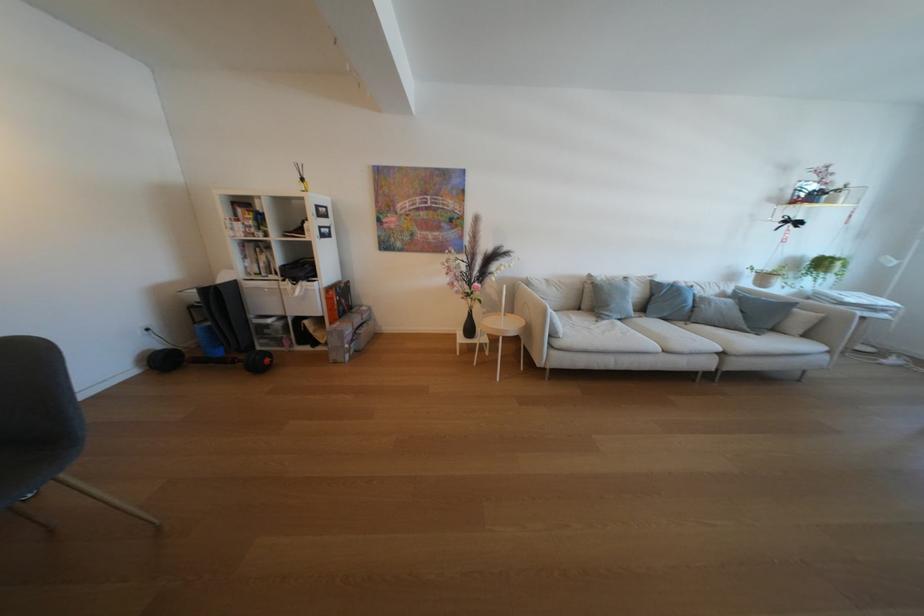
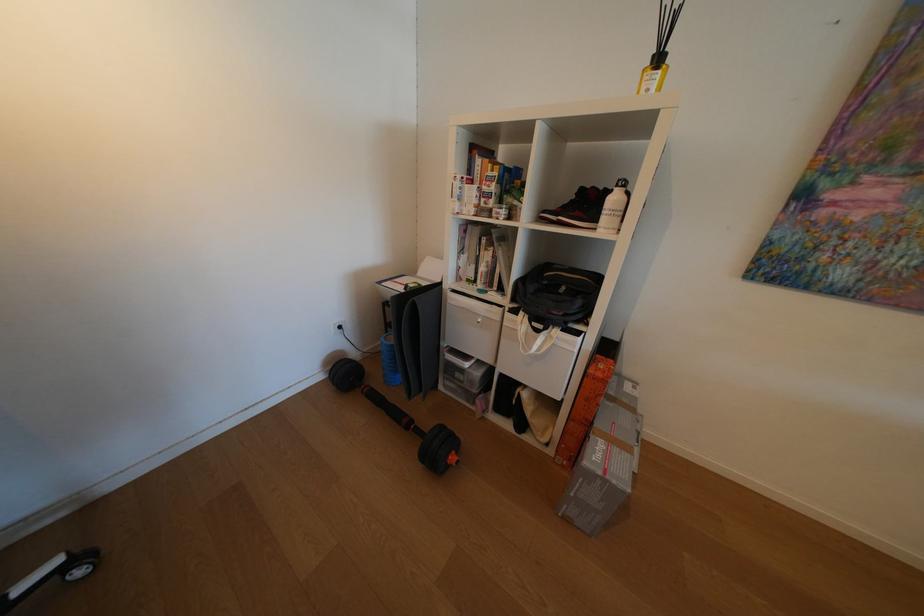
The point at (297, 233) is marked in the first image. Where is the corresponding point in the second image?

(554, 213)